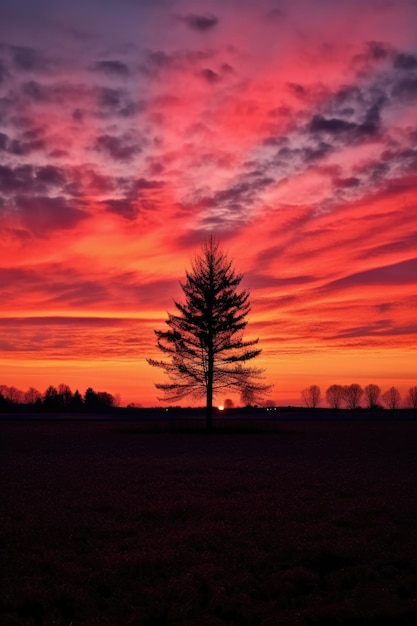
The image size is (417, 626). Identify the location of lights. (271, 409).